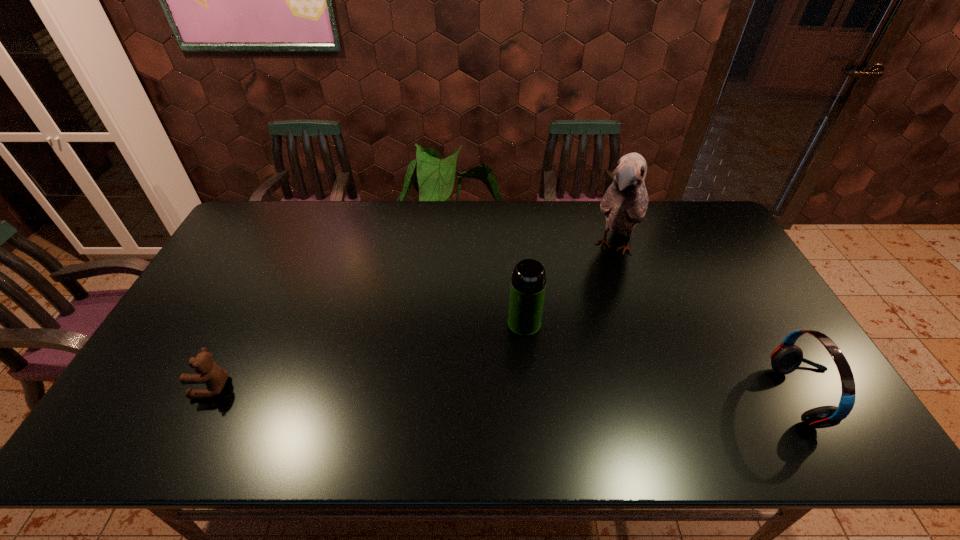
At what (x,y) coordinates should I click in order to perform the action: click on object that is positioned at the right edge. Please return your answer as a coordinate pair (x, y). Looking at the image, I should click on (785, 359).

At what (x,y) coordinates should I click in order to perform the action: click on object that is at the near left corner. Please return your answer as a coordinate pair (x, y). Looking at the image, I should click on (207, 371).

The width and height of the screenshot is (960, 540). I want to click on object present at the near right corner, so click(785, 359).

Find the location of a particular element. free region at the far edge of the desktop is located at coordinates (583, 220).

The height and width of the screenshot is (540, 960). I want to click on vacant space at the near edge of the desktop, so click(x=391, y=395).

Where is `vacant space at the left edge of the desktop`? This screenshot has width=960, height=540. vacant space at the left edge of the desktop is located at coordinates (217, 310).

Image resolution: width=960 pixels, height=540 pixels. I want to click on vacant area at the right edge, so click(x=705, y=282).

The width and height of the screenshot is (960, 540). Find the location of `free space at the far left corner of the desktop`. free space at the far left corner of the desktop is located at coordinates (250, 227).

Locate an element on the screen. vacant space at the near left corner of the desktop is located at coordinates (168, 406).

You are a GUI agent. You are given a task and a screenshot of the screen. Output one action in this format:
    pyautogui.click(x=<x>, y=<y>)
    Task: Click on the free space that is in between the shortest object and the third object from right to left
    Image resolution: width=960 pixels, height=540 pixels.
    Given the screenshot: What is the action you would take?
    pyautogui.click(x=369, y=355)